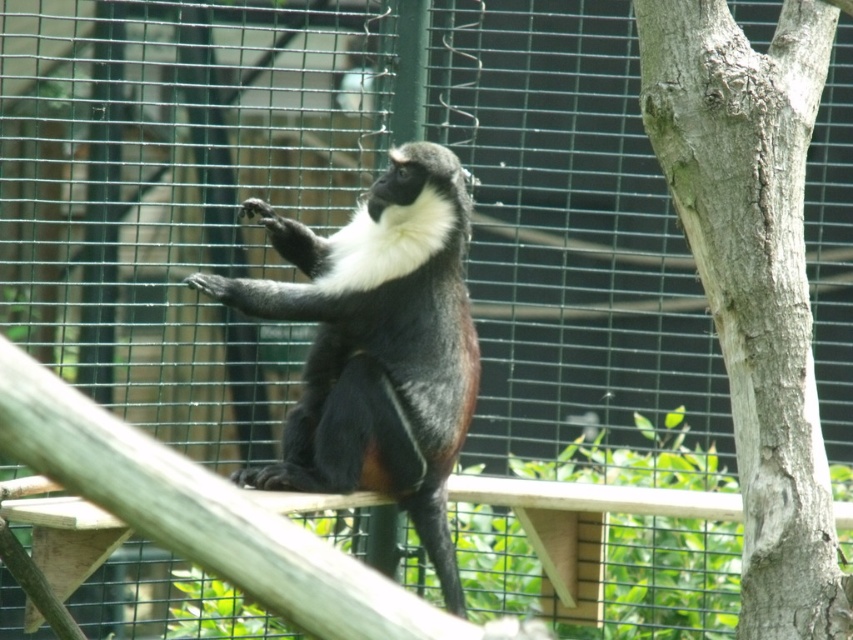
In the scene shown: You are a zookeeper observing the enclosure. You notice the shiny black fur monkey at center and the smooth gray bark at right. Which object is positioned to the right of the other?

The smooth gray bark at right is to the right of the shiny black fur monkey at center.

You are a zookeeper who needs to place two feeding stations at the coordinates point (708, 170) and point (310, 388). Which feeding station will be closer to the monkey currently resting on the wooden structure?

Point (708, 170) is in front of point (310, 388), so the feeding station at point (708, 170) will be closer to the monkey currently resting on the wooden structure.

You are a zookeeper trying to determine the best way to place a new feeding tray between the smooth gray bark at right and the shiny black fur monkey at center. Since the feeding tray requires a stable surface, which object would be more suitable for placing it on?

The shiny black fur monkey at center is thicker than the smooth gray bark at right, so the feeding tray should be placed on the shiny black fur monkey at center for stability.